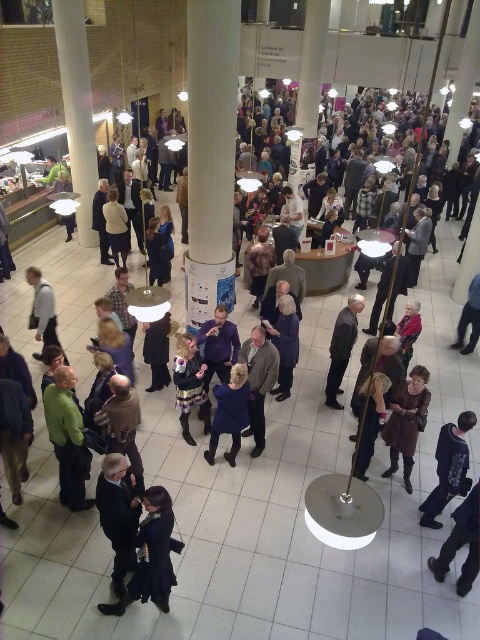
Question: Can you confirm if dark gray sweater at center is positioned to the left of dark blue dress at lower right?

Choices:
 (A) no
 (B) yes

Answer: (B)

Question: Estimate the real-world distances between objects in this image. Which object is closer to the dark blue sweater at lower right?

Choices:
 (A) dark brown leather jacket at lower left
 (B) dark blue sweater at center

Answer: (B)

Question: Estimate the real-world distances between objects in this image. Which object is closer to the dark brown leather jacket at lower left?

Choices:
 (A) dark blue sweater at center
 (B) dark blue dress at lower right

Answer: (A)

Question: Which of these objects is positioned farthest from the dark gray sweater at center?

Choices:
 (A) dark blue suit at center
 (B) dark gray suit at center
 (C) dark brown leather jacket at lower left
 (D) dark blue sweater at lower right

Answer: (A)

Question: From the image, what is the correct spatial relationship of brown leather coat at center in relation to dark blue dress at lower right?

Choices:
 (A) left
 (B) right

Answer: (A)

Question: Is dark gray sweater at center smaller than dark gray suit at center?

Choices:
 (A) no
 (B) yes

Answer: (A)